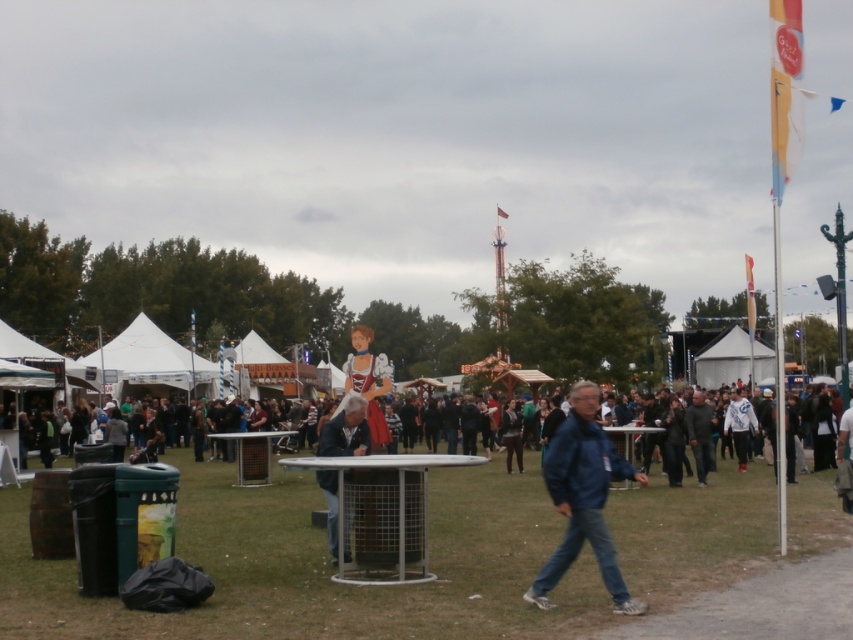
You are at the fair and want to find the denim jacket at center. According to the coordinates provided, where should you look?

You should look at point (345, 432) to find the denim jacket at center.